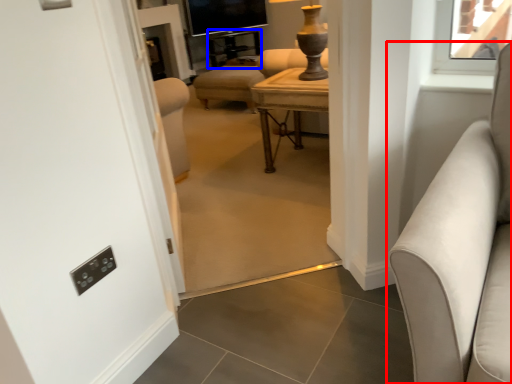
Question: Among these objects, which one is nearest to the camera, studio couch (highlighted by a red box) or side table (highlighted by a blue box)?

Choices:
 (A) studio couch
 (B) side table

Answer: (A)